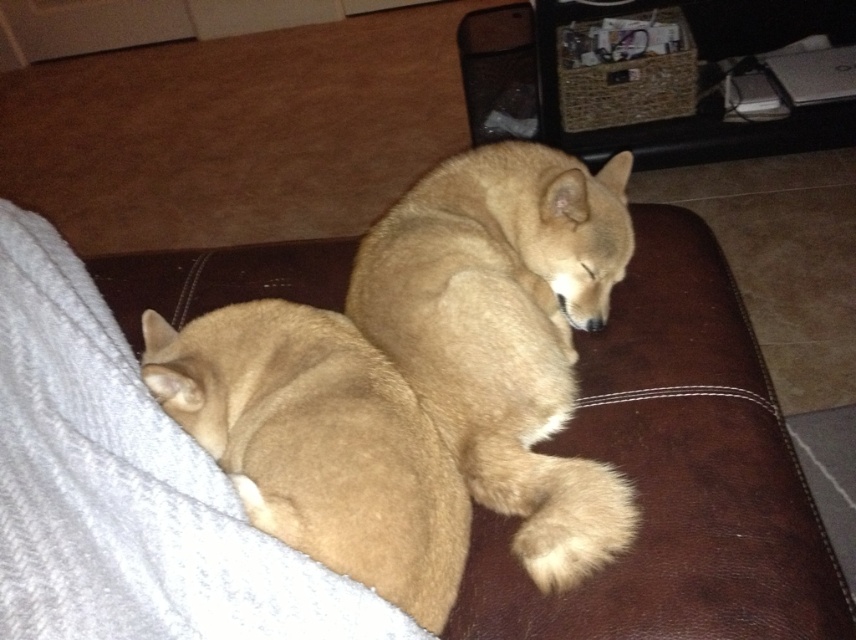
You are trying to locate the exact spot where a small toy is placed on the couch in the image. The coordinates given are point (x=506, y=332). According to the scene description, where exactly is this point located?

The point (x=506, y=332) is located on the light brown fur at center.

In the scene shown: You are a cat owner who wants to place a new gray fabric dog bed at lower left in the living room. Based on the scene, where should you position it to avoid blocking the cats resting on the couch?

The gray fabric dog bed at lower left should be placed at point (x=126, y=490) to avoid blocking the cats resting on the couch as it is the designated spot according to the scene description.

You are a cat owner who wants to place a new gray fabric dog bed at lower left in the living room. Based on the scene, can you confirm if there is space available at point (126,490) for the dog bed?

Yes, the gray fabric dog bed at lower left can be placed at point (126,490) as there is space available there.